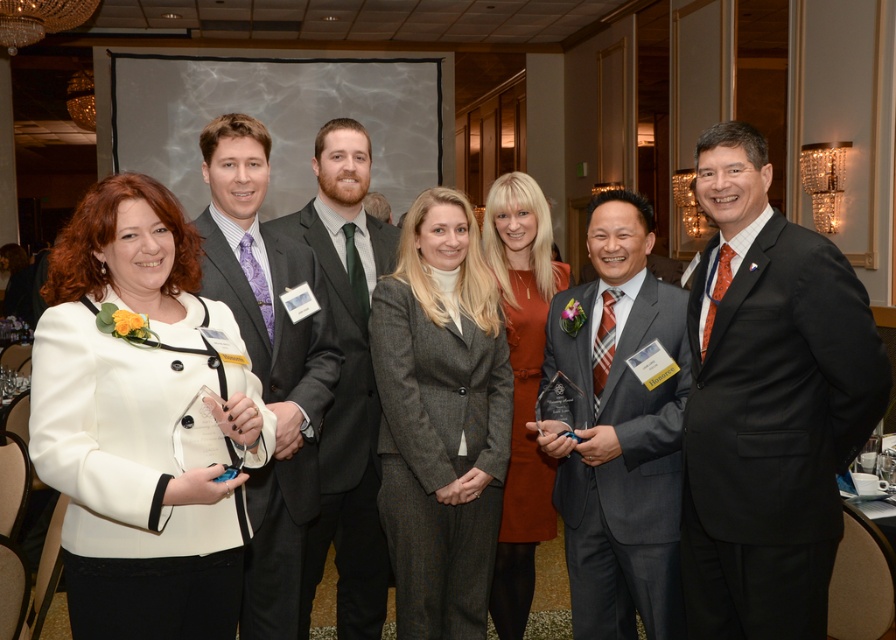
Which is in front, point (470, 579) or point (280, 404)?

Point (280, 404) is more forward.

Locate an element on the screen. gray wool suit at center is located at coordinates (440, 419).

Is point (450, 269) more distant than point (369, 220)?

No.

Does gray wool suit at center have a smaller size compared to dark gray suit at center?

Correct, gray wool suit at center occupies less space than dark gray suit at center.

Does point (438, 500) come farther from viewer compared to point (337, 289)?

No, it is in front of (337, 289).

The width and height of the screenshot is (896, 640). Identify the location of gray wool suit at center. (440, 419).

Between point (360, 428) and point (505, 264), which one is positioned behind?

Point (505, 264)

Based on the photo, is dark gray suit at center to the left of orange fabric dress at center from the viewer's perspective?

Indeed, dark gray suit at center is positioned on the left side of orange fabric dress at center.

Is point (345, 524) positioned after point (532, 490)?

No, it is not.

Identify the location of dark gray suit at center. [346, 381].